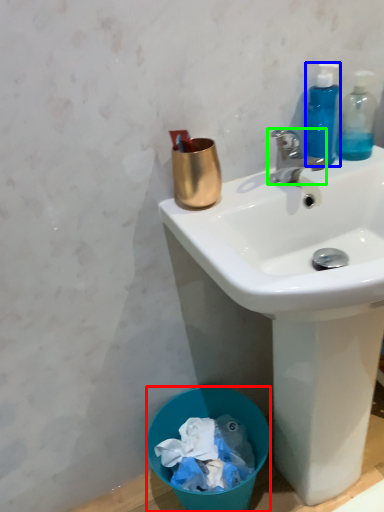
Question: Based on their relative distances, which object is nearer to trash bin/can (highlighted by a red box)? Choose from bottle (highlighted by a blue box) and faucet (highlighted by a green box).

Choices:
 (A) bottle
 (B) faucet

Answer: (B)